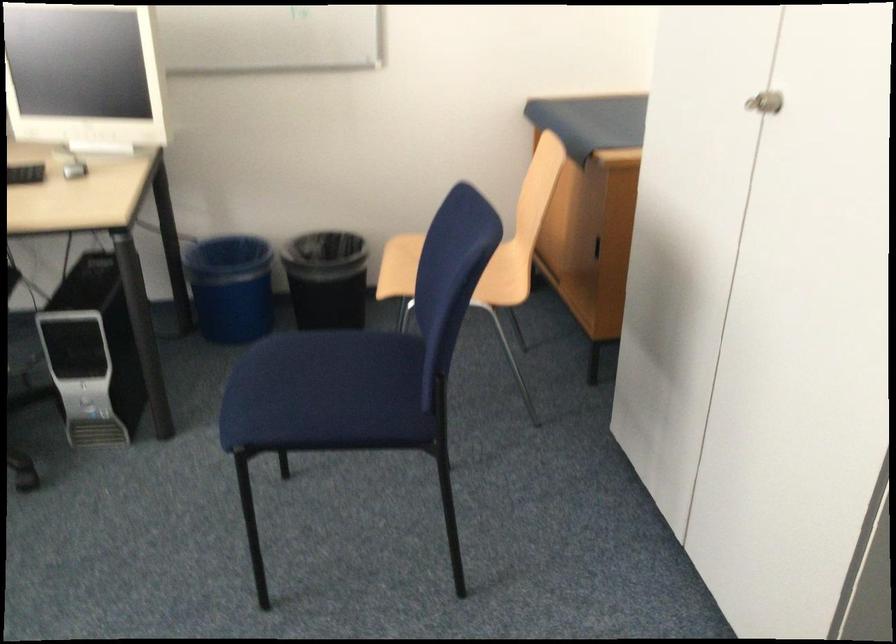
Question: Based on the continuous images, in which direction is the camera rotating? Reply with the corresponding letter.

Choices:
 (A) Left
 (B) Right
 (C) Up
 (D) Down

Answer: (A)